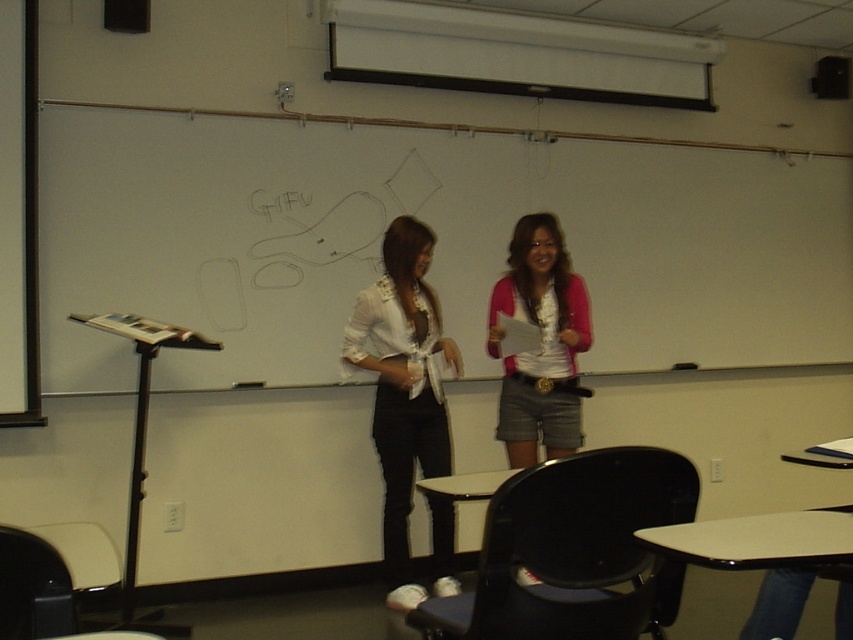
From the picture: In the classroom scene, there are two people near the whiteboard. One is holding a paper or booklet. Can you tell me what object is located at the coordinates point (437, 244)?

The point (437, 244) indicates the white matte whiteboard at center.

You are a student trying to write a note on the whiteboard. You have a marker that can only reach up to 1 meter. Can you determine if the white matte whiteboard at center is wider than the white satin blouse at center?

The white matte whiteboard at center might be wider than white satin blouse at center, so it is possible that the whiteboard is wider. However, without exact measurements, we cannot be certain. The student should check the actual dimensions before deciding.